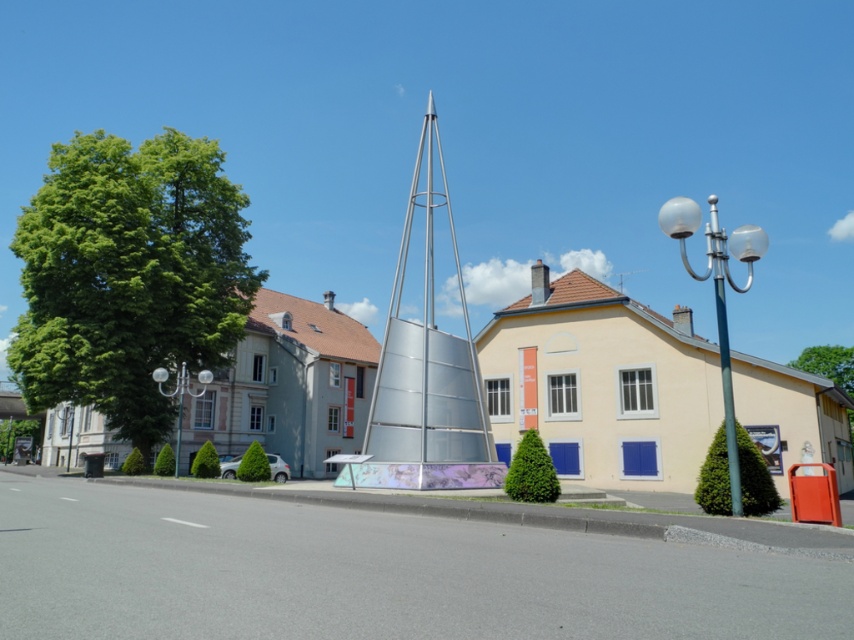
Based on the photo, who is positioned more to the right, metallic silver spire at center or green leafy tree at right?

Positioned to the right is green leafy tree at right.

Which is in front, point (396, 408) or point (822, 360)?

Positioned in front is point (396, 408).

Is point (430, 291) positioned behind point (825, 360)?

No.

The height and width of the screenshot is (640, 854). Identify the location of metallic silver spire at center. (427, 353).

Can you confirm if green leafy tree at left is bigger than green leafy tree at lower left?

Yes, green leafy tree at left is bigger than green leafy tree at lower left.

Is green leafy tree at left closer to the viewer compared to green leafy tree at lower left?

Yes, it is.

Measure the distance between green leafy tree at left and camera.

→ They are 26.49 meters apart.

This screenshot has height=640, width=854. In order to click on green leafy tree at left in this screenshot , I will do `click(129, 275)`.

Between point (724, 269) and point (32, 445), which one is positioned behind?

The point (32, 445) is more distant.

Which is above, green metallic streetlight at upper right or green leafy tree at lower left?

green metallic streetlight at upper right is higher up.

Between point (689, 273) and point (34, 422), which one is positioned behind?

The point (689, 273) is behind.

At what (x,y) coordinates should I click in order to perform the action: click on green metallic streetlight at upper right. Please return your answer as a coordinate pair (x, y). This screenshot has height=640, width=854. Looking at the image, I should click on (717, 296).